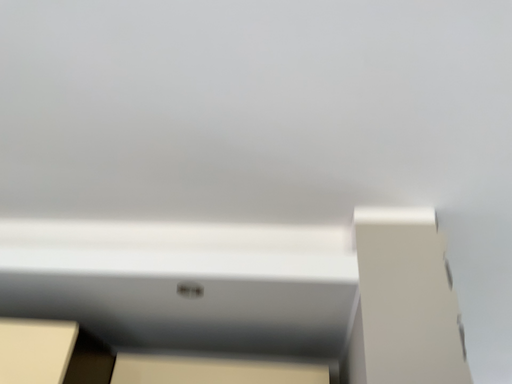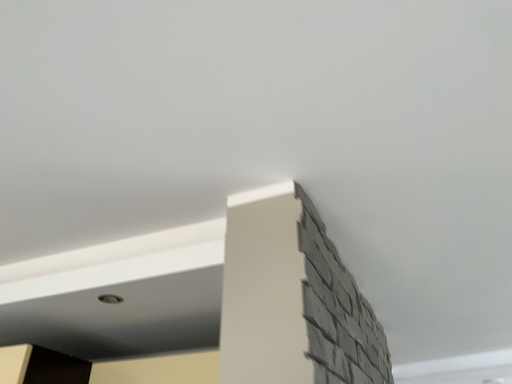
Question: How did the camera likely rotate when shooting the video?

Choices:
 (A) rotated left
 (B) rotated right

Answer: (A)